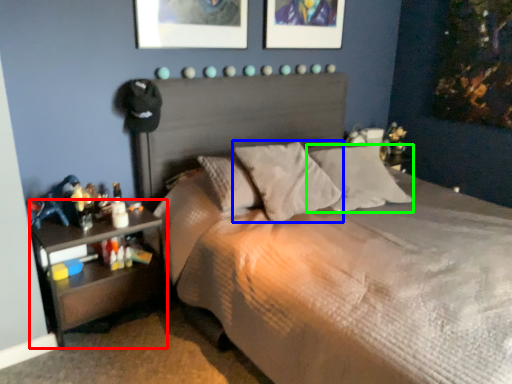
Question: Which is farther away from nightstand (highlighted by a red box)? pillow (highlighted by a blue box) or pillow (highlighted by a green box)?

Choices:
 (A) pillow
 (B) pillow

Answer: (B)